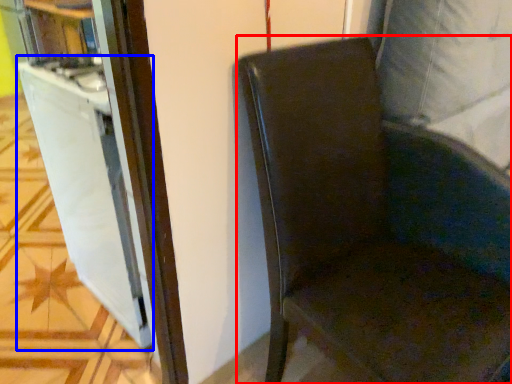
Question: Which point is further to the camera, chair (highlighted by a red box) or file cabinet (highlighted by a blue box)?

Choices:
 (A) chair
 (B) file cabinet

Answer: (B)